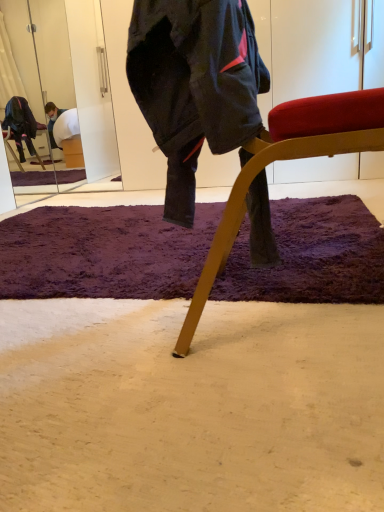
Question: From the image's perspective, is wooden chair at center located above dark blue fabric jacket at center?

Choices:
 (A) yes
 (B) no

Answer: (B)

Question: Can dark blue fabric jacket at center be found inside wooden chair at center?

Choices:
 (A) yes
 (B) no

Answer: (A)

Question: Is wooden chair at center thinner than dark blue fabric jacket at center?

Choices:
 (A) no
 (B) yes

Answer: (A)

Question: Does wooden chair at center appear on the right side of dark blue fabric jacket at center?

Choices:
 (A) yes
 (B) no

Answer: (A)

Question: Is wooden chair at center wider than dark blue fabric jacket at center?

Choices:
 (A) no
 (B) yes

Answer: (B)

Question: Are wooden chair at center and dark blue fabric jacket at center far apart?

Choices:
 (A) no
 (B) yes

Answer: (A)

Question: Does purple shaggy rug at center have a smaller size compared to dark blue fabric jacket at center?

Choices:
 (A) no
 (B) yes

Answer: (A)

Question: Does purple shaggy rug at center have a greater width compared to dark blue fabric jacket at center?

Choices:
 (A) no
 (B) yes

Answer: (B)

Question: From a real-world perspective, does purple shaggy rug at center sit lower than dark blue fabric jacket at center?

Choices:
 (A) yes
 (B) no

Answer: (A)

Question: Is purple shaggy rug at center at the left side of dark blue fabric jacket at center?

Choices:
 (A) yes
 (B) no

Answer: (A)

Question: Is purple shaggy rug at center aimed at dark blue fabric jacket at center?

Choices:
 (A) yes
 (B) no

Answer: (B)

Question: From a real-world perspective, is purple shaggy rug at center positioned over dark blue fabric jacket at center based on gravity?

Choices:
 (A) yes
 (B) no

Answer: (B)

Question: Can you confirm if wooden chair at center is wider than purple shaggy rug at center?

Choices:
 (A) no
 (B) yes

Answer: (A)